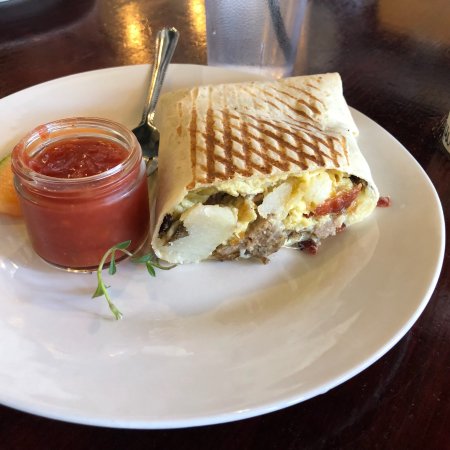
Where is `fork`? fork is located at coordinates (154, 83).